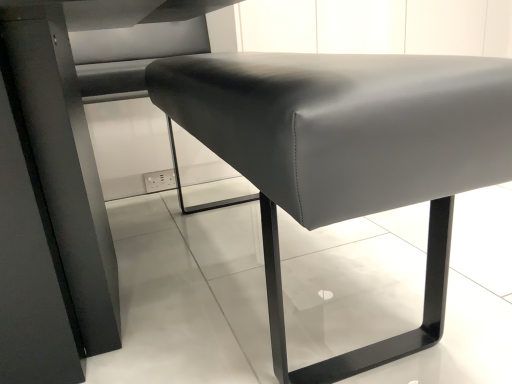
What is the approximate height of matte black bench at center?

23.19 inches.

The image size is (512, 384). Describe the element at coordinates (348, 154) in the screenshot. I see `matte black bench at center` at that location.

What is the approximate width of matte black bench at center?

The width of matte black bench at center is 17.58 inches.

Identify the location of matte black bench at center. (348, 154).

Image resolution: width=512 pixels, height=384 pixels. I want to click on matte black bench at center, so click(x=348, y=154).